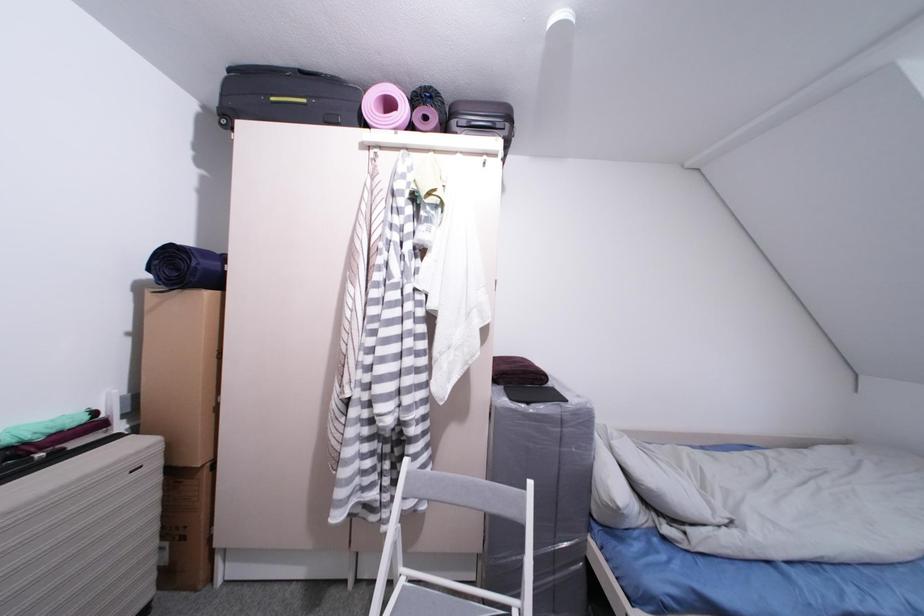
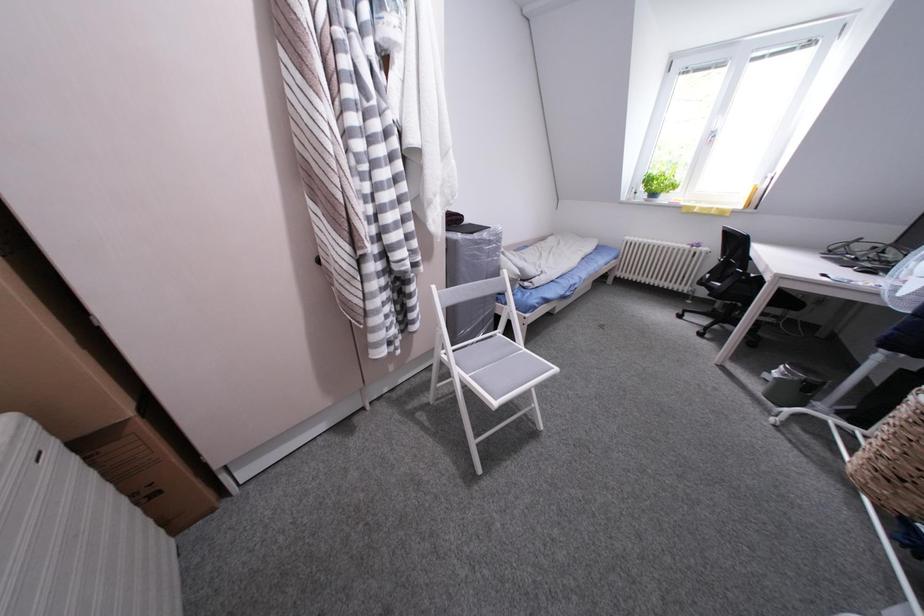
The images are taken continuously from a first-person perspective. In which direction is your viewpoint rotating?

The rotation direction of the camera is right-down.